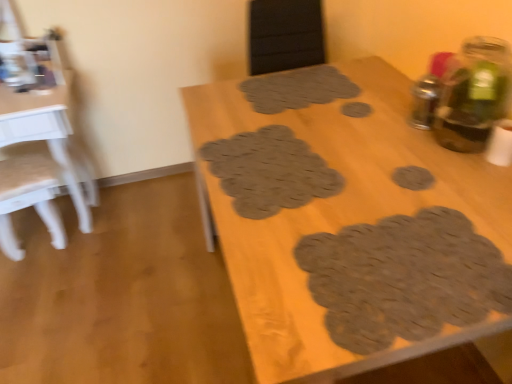
Where is `free space between brown textured mat at center, positioned as the 3th footprint in top-to-bottom order, and brown textured coaster at center-right, the second footprint in the bottom-to-top sequence`? This screenshot has width=512, height=384. free space between brown textured mat at center, positioned as the 3th footprint in top-to-bottom order, and brown textured coaster at center-right, the second footprint in the bottom-to-top sequence is located at coordinates (355, 175).